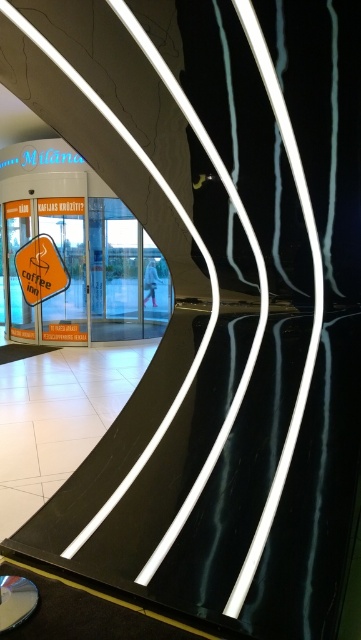
Question: Which of the following is the farthest from the observer?

Choices:
 (A) orange plastic sign at center
 (B) orange matte coffee sign at left

Answer: (B)

Question: Which object is farther from the camera taking this photo?

Choices:
 (A) orange matte coffee sign at left
 (B) orange plastic sign at center

Answer: (A)

Question: Which of the following is the farthest from the observer?

Choices:
 (A) (22, 256)
 (B) (54, 294)

Answer: (A)

Question: Considering the relative positions of orange plastic sign at center and orange matte coffee sign at left in the image provided, where is orange plastic sign at center located with respect to orange matte coffee sign at left?

Choices:
 (A) right
 (B) left

Answer: (A)

Question: Observing the image, what is the correct spatial positioning of orange plastic sign at center in reference to orange matte coffee sign at left?

Choices:
 (A) left
 (B) right

Answer: (B)

Question: Where is orange plastic sign at center located in relation to orange matte coffee sign at left in the image?

Choices:
 (A) left
 (B) right

Answer: (B)